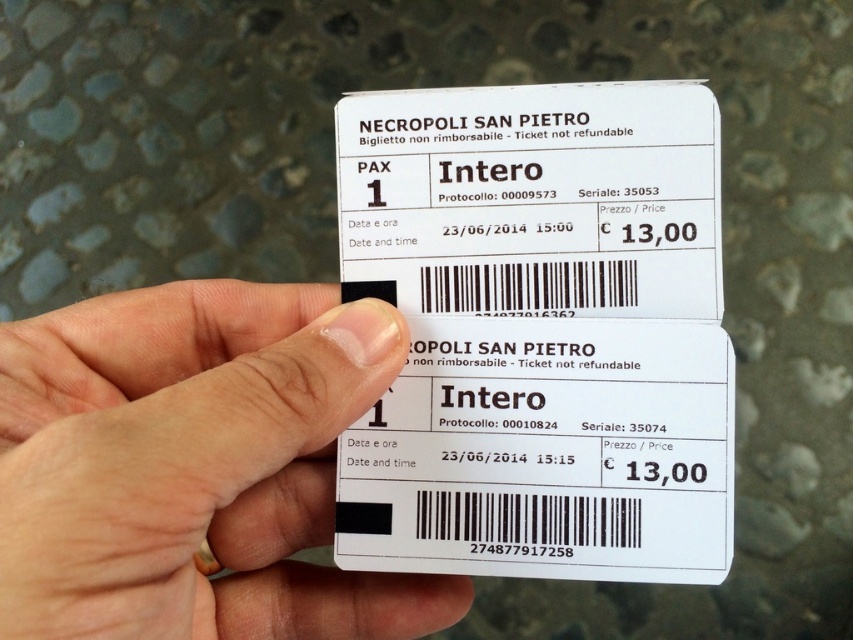
You are holding two tickets for Necropoli San Pietro. You need to locate the specific point marked as point (540, 332). Where exactly is this point located?

The point (540, 332) is on the white paper ticket at center.

You are holding a white paper ticket at center in your hand. Where is the ticket located relative to your hand?

The white paper ticket at center is located at point (540, 332) relative to your hand.